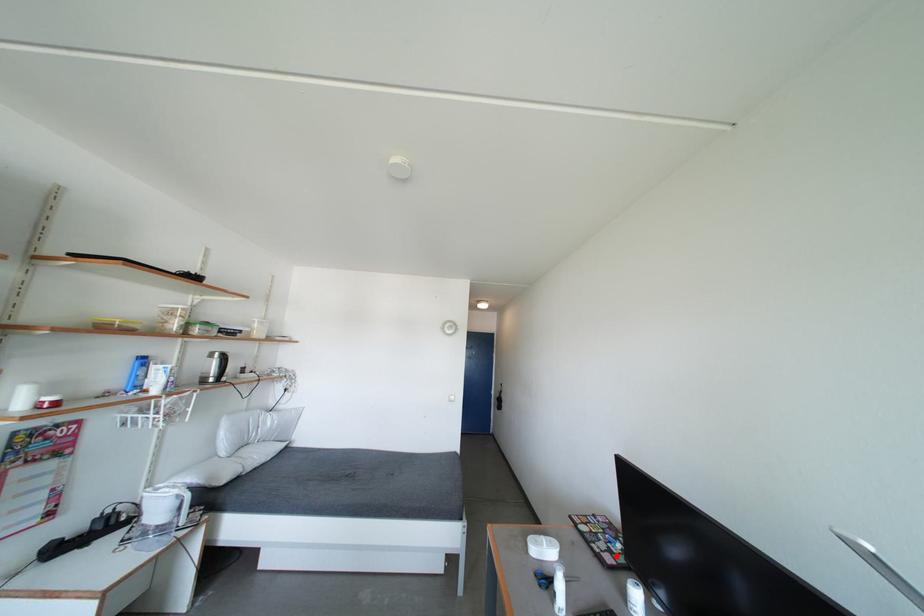
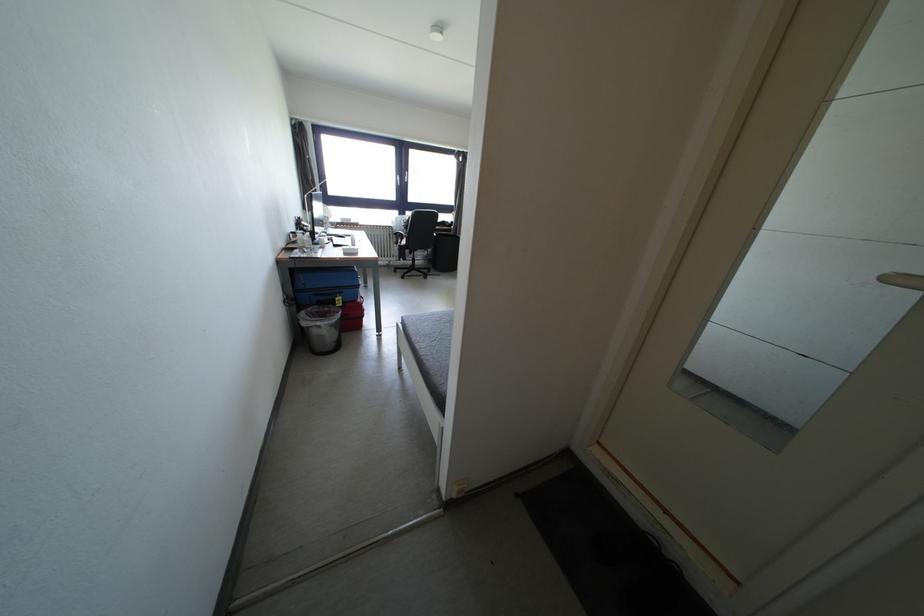
Question: I am providing you with two images of the same scene from different viewpoints. A red point is marked on the first image. Is the red point's position out of view in image 2?

Choices:
 (A) Yes
 (B) No

Answer: (A)